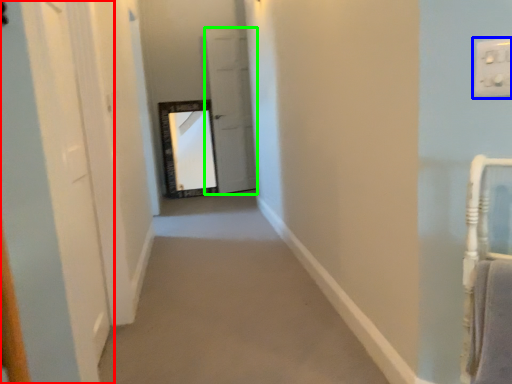
Question: Which object is positioned closest to door (highlighted by a red box)? Select from electric outlet (highlighted by a blue box) and door (highlighted by a green box).

Choices:
 (A) electric outlet
 (B) door

Answer: (A)